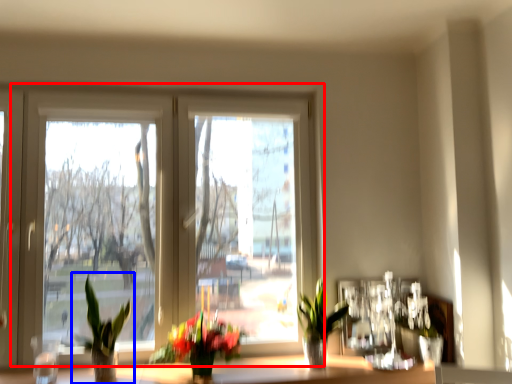
Question: Which of the following is the farthest to the observer, window (highlighted by a red box) or houseplant (highlighted by a blue box)?

Choices:
 (A) window
 (B) houseplant

Answer: (A)